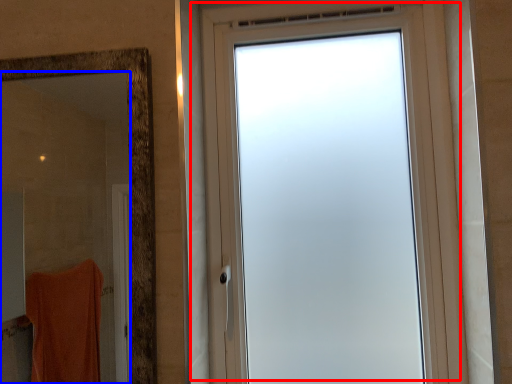
Question: Which of the following is the farthest to the observer, window (highlighted by a red box) or mirror (highlighted by a blue box)?

Choices:
 (A) window
 (B) mirror

Answer: (A)